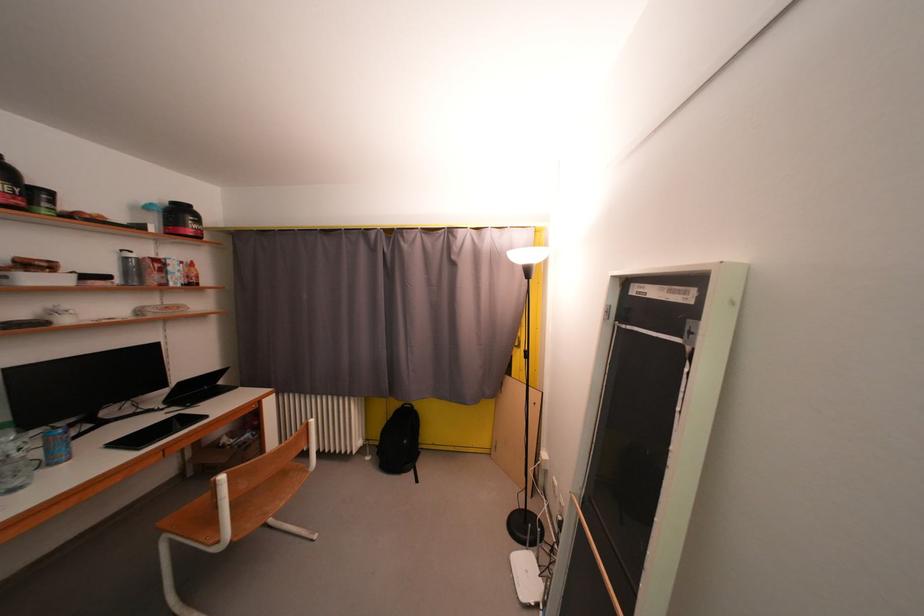
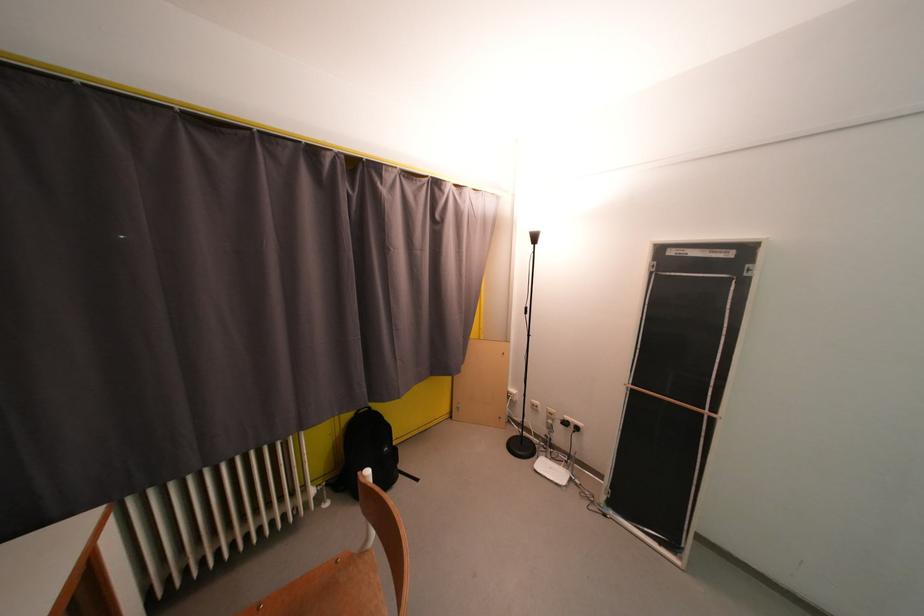
In the second image, find the point that corresponds to pixel 419 410 in the first image.

(378, 411)